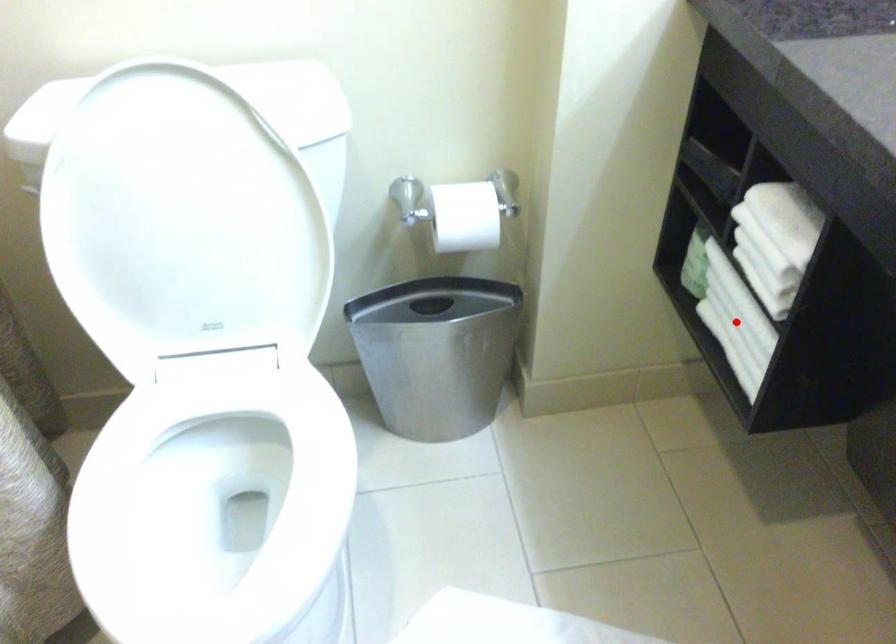
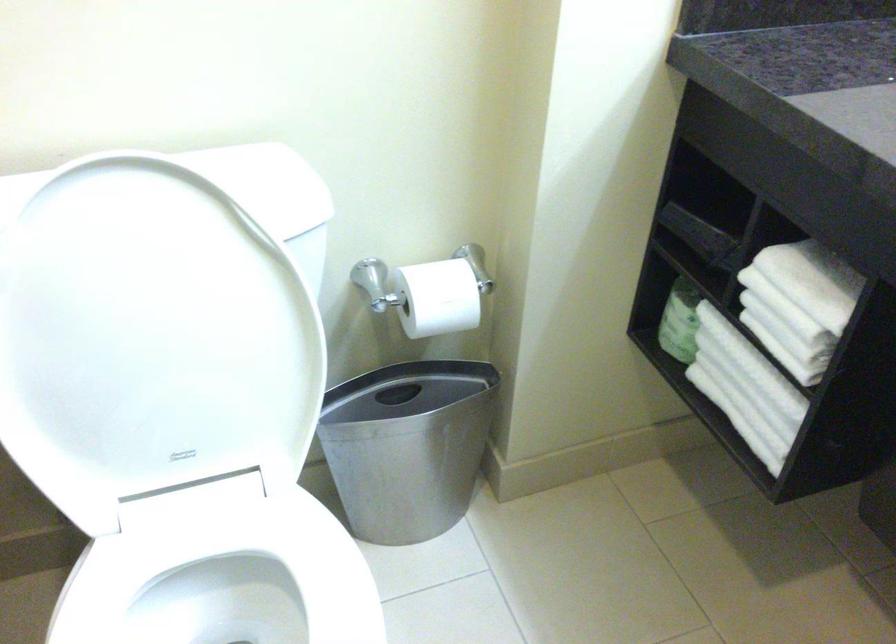
In the second image, find the point that corresponds to the highlighted location in the first image.

(745, 388)